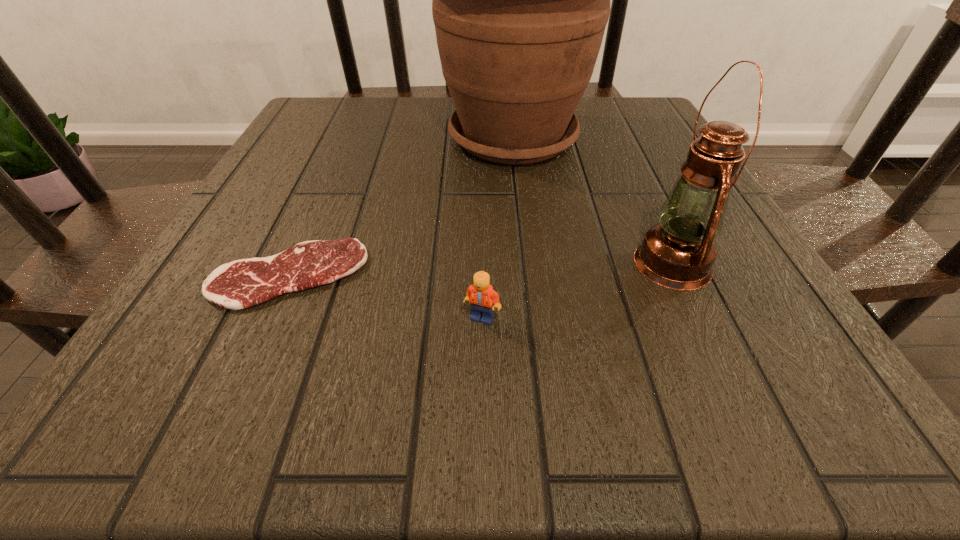
This screenshot has height=540, width=960. Find the location of `the farthest object`. the farthest object is located at coordinates (520, 0).

Where is `oil lamp`? oil lamp is located at coordinates (678, 253).

Locate an element on the screen. The image size is (960, 540). Lego is located at coordinates (481, 296).

You are a GUI agent. You are given a task and a screenshot of the screen. Output one action in this format:
    pyautogui.click(x=<x>, y=<y>)
    Task: Click on the shortest object
    
    Given the screenshot: What is the action you would take?
    243,283

Where is `the leftmost object`? This screenshot has height=540, width=960. the leftmost object is located at coordinates (243, 283).

Image resolution: width=960 pixels, height=540 pixels. Identify the location of vacant space situated on the front of the flowerpot. (536, 338).

This screenshot has width=960, height=540. Find the location of `blank area located 0.400m on the left of the oil lamp`. blank area located 0.400m on the left of the oil lamp is located at coordinates [379, 264].

Locate an element on the screen. This screenshot has height=540, width=960. free space located 0.130m on the front-facing side of the third tallest object is located at coordinates (483, 414).

Where is `vacant space located on the back of the leftmost object`? vacant space located on the back of the leftmost object is located at coordinates (353, 132).

Locate an element on the screen. The height and width of the screenshot is (540, 960). object that is positioned at the far edge is located at coordinates (520, 0).